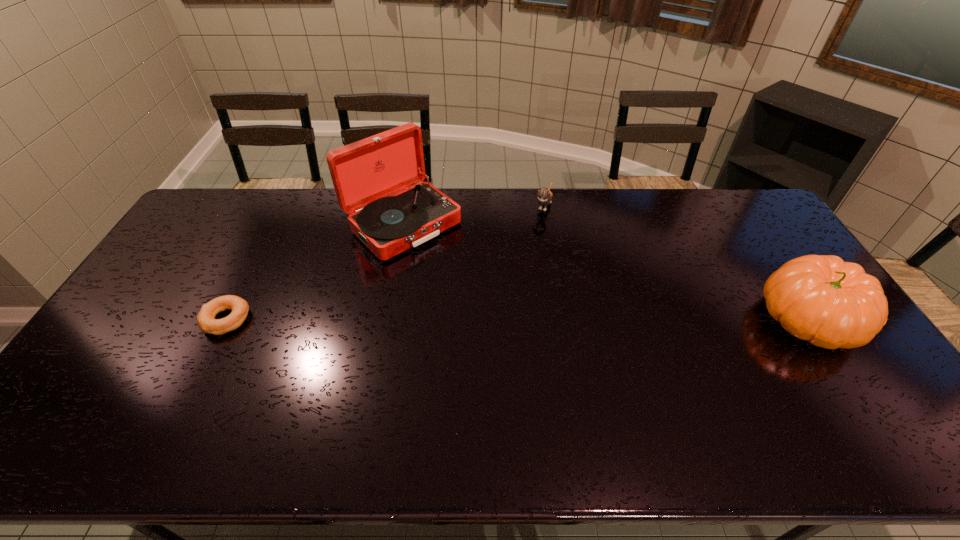
At what (x,y) coordinates should I click in order to perform the action: click on free spot on the desktop that is between the shortest object and the third shortest object and is positioned on the front-facing side of the phonograph_record. Please return your answer as a coordinate pair (x, y). This screenshot has width=960, height=540. Looking at the image, I should click on (510, 319).

The width and height of the screenshot is (960, 540). In order to click on vacant space on the desktop that is between the leftmost object and the pumpkin and is positioned on the front-facing side of the second shortest object in this screenshot , I will do `click(484, 319)`.